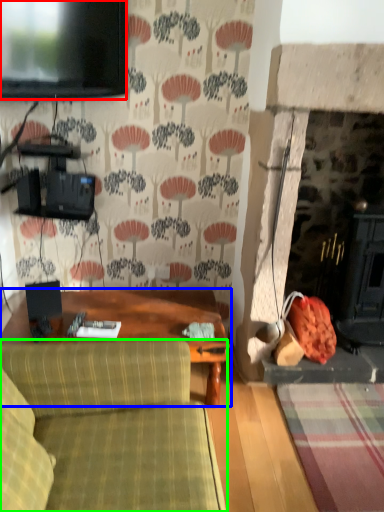
Question: Based on their relative distances, which object is nearer to television (highlighted by a red box)? Choose from table (highlighted by a blue box) and studio couch (highlighted by a green box).

Choices:
 (A) table
 (B) studio couch

Answer: (A)